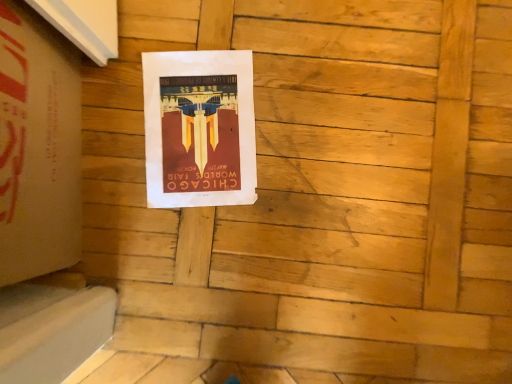
Identify the location of free space above maroon paper poster at center (from a real-world perspective). (200, 127).